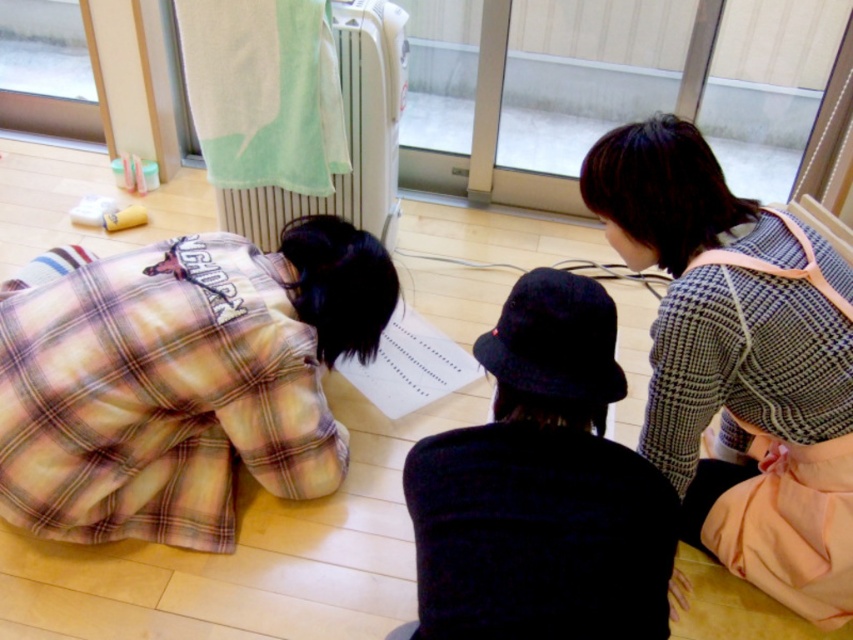
Question: Does checkered fabric sweater at upper right have a greater width compared to transparent glass door at upper center?

Choices:
 (A) no
 (B) yes

Answer: (A)

Question: Among these points, which one is nearest to the camera?

Choices:
 (A) (80, 538)
 (B) (93, 77)
 (C) (397, 74)
 (D) (495, 48)

Answer: (A)

Question: Is plaid fabric at left wider than checkered fabric sweater at upper right?

Choices:
 (A) yes
 (B) no

Answer: (A)

Question: Does checkered fabric sweater at upper right appear on the right side of transparent plastic screen door at upper left?

Choices:
 (A) yes
 (B) no

Answer: (A)

Question: Among these objects, which one is farthest from the camera?

Choices:
 (A) transparent glass door at upper center
 (B) white plastic radiator at upper center
 (C) checkered fabric sweater at upper right

Answer: (A)

Question: Among these points, which one is farthest from the camera?

Choices:
 (A) (90, 435)
 (B) (671, 298)
 (C) (404, 72)
 (D) (3, 67)

Answer: (D)